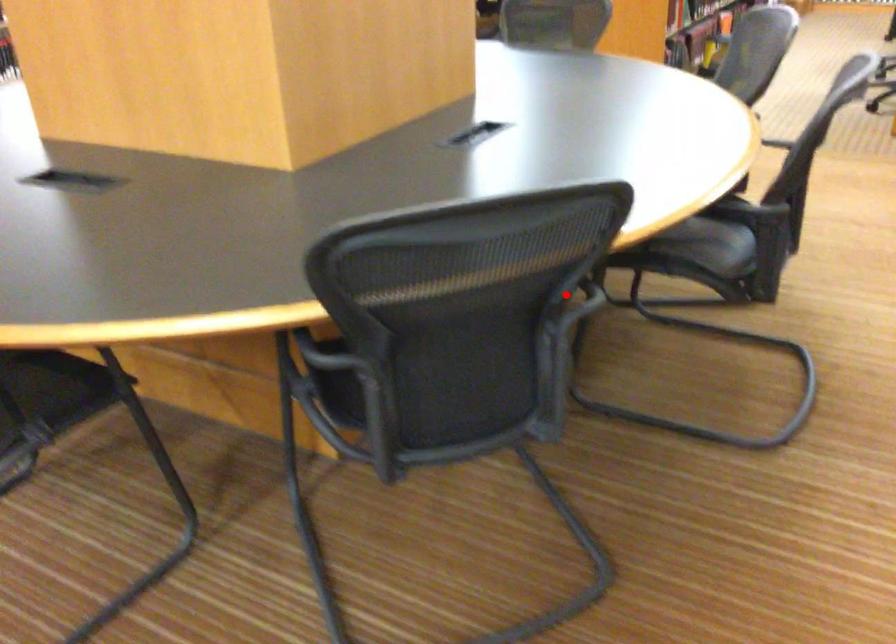
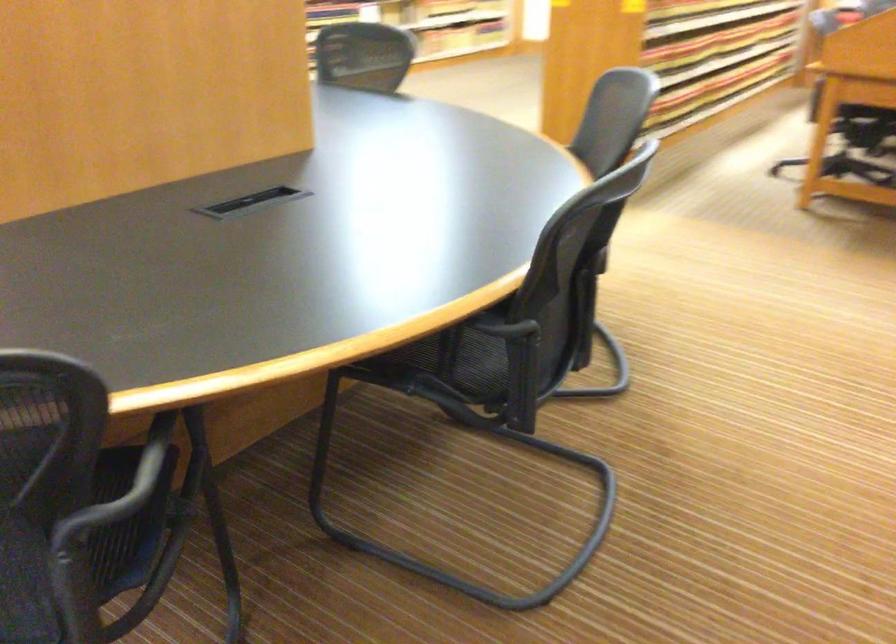
The point at the highlighted location is marked in the first image. Where is the corresponding point in the second image?

(151, 460)